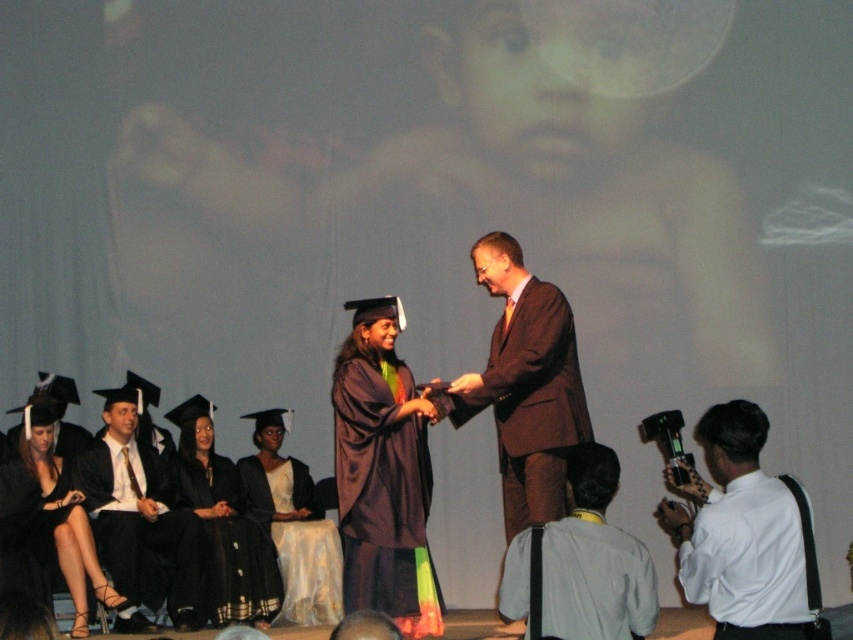
You are a photographer standing at the back of the auditorium. You need to capture a photo that includes both the matte black gown at center and the black satin suit at left. The camera you are using has a maximum focus range of 2.5 meters. Will you be able to fit both subjects into the frame without moving closer?

The distance between the matte black gown at center and the black satin suit at left is 2.32 meters, which is within the camera maximum focus range of 2.5 meters. Therefore, you can fit both subjects into the frame without moving closer.

You are a photographer positioned at the back of the auditorium. You need to capture a photo of the matte black gown at center without the gray fabric camera at lower right appearing in the frame. Is this possible based on their positions?

The matte black gown at center is to the left of the gray fabric camera at lower right. Since the camera is on the right side relative to the gown, positioning yourself appropriately could allow you to frame the shot so the gown is visible while the camera is outside the frame.